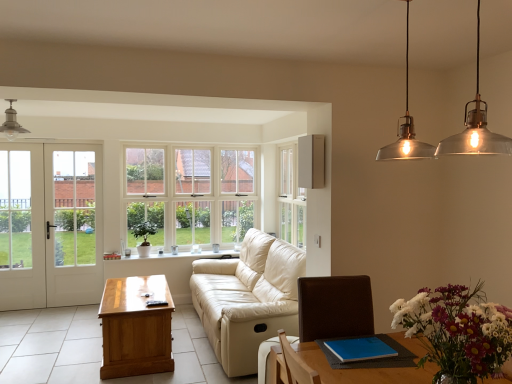
Find the location of a particular element. The width and height of the screenshot is (512, 384). vacant space in matte silver light fixture at upper left (from a real-world perspective) is located at coordinates (12, 357).